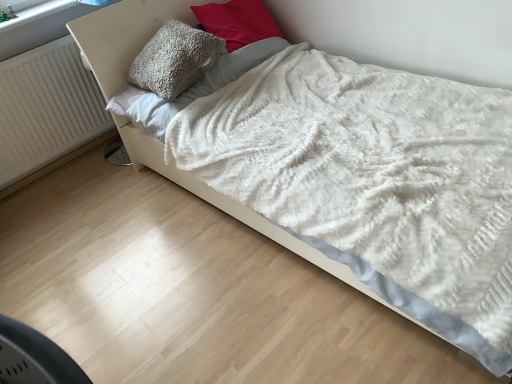
Locate an element on the screen. fluffy gray pillow at upper center, which is counted as the second pillow, starting from the right is located at coordinates (174, 59).

Image resolution: width=512 pixels, height=384 pixels. Describe the element at coordinates (174, 59) in the screenshot. I see `fluffy gray pillow at upper center, which is counted as the second pillow, starting from the right` at that location.

The height and width of the screenshot is (384, 512). I want to click on white ribbed radiator at left, so (x=46, y=108).

Find the location of a particular element. white fluffy sheet at upper center is located at coordinates tap(191, 88).

How much space does fuzzy gray pillow at upper center, which is the second pillow in left-to-right order, occupy vertically?

It is 15.24 inches.

You are a GUI agent. You are given a task and a screenshot of the screen. Output one action in this format:
    pyautogui.click(x=<x>, y=<y>)
    Task: Click on the fluffy gray pillow at upper center, positioned as the 1th pillow in left-to-right order
    This screenshot has width=512, height=384.
    Given the screenshot: What is the action you would take?
    pyautogui.click(x=174, y=59)

This screenshot has width=512, height=384. I want to click on sheet lying on the right of white ribbed radiator at left, so [x=191, y=88].

How many degrees apart are the facing directions of white ribbed radiator at left and white fluffy sheet at upper center?

The facing directions of white ribbed radiator at left and white fluffy sheet at upper center are 0.689 degrees apart.

From the picture: Which of these two, white ribbed radiator at left or white fluffy sheet at upper center, stands taller?

white ribbed radiator at left is taller.

Is point (236, 0) positioned in front of point (25, 139)?

Yes, it is in front of point (25, 139).

From the picture: Is fuzzy gray pillow at upper center, the 1th pillow positioned from the right, positioned behind white ribbed radiator at left?

Yes, fuzzy gray pillow at upper center, the 1th pillow positioned from the right, is behind white ribbed radiator at left.

Could you tell me if fuzzy gray pillow at upper center, the 1th pillow positioned from the right, is facing white ribbed radiator at left?

No, fuzzy gray pillow at upper center, the 1th pillow positioned from the right, is not aimed at white ribbed radiator at left.

From the image's perspective, which is below, fuzzy gray pillow at upper center, which is the second pillow in left-to-right order, or white ribbed radiator at left?

white ribbed radiator at left appears lower in the image.

Visually, is fluffy gray pillow at upper center, positioned as the 1th pillow in left-to-right order, positioned to the left or to the right of white plastic window frame at upper left?

From the image, it's evident that fluffy gray pillow at upper center, positioned as the 1th pillow in left-to-right order, is to the right of white plastic window frame at upper left.

Could you tell me if fluffy gray pillow at upper center, which is counted as the second pillow, starting from the right, is facing white plastic window frame at upper left?

No, fluffy gray pillow at upper center, which is counted as the second pillow, starting from the right, is not oriented towards white plastic window frame at upper left.

Considering the sizes of objects fluffy gray pillow at upper center, which is counted as the second pillow, starting from the right, and white plastic window frame at upper left in the image provided, who is shorter, fluffy gray pillow at upper center, which is counted as the second pillow, starting from the right, or white plastic window frame at upper left?

With less height is white plastic window frame at upper left.

Locate an element on the screen. Image resolution: width=512 pixels, height=384 pixels. window frame to the left of fluffy gray pillow at upper center, which is counted as the second pillow, starting from the right is located at coordinates (37, 13).

From a real-world perspective, is white ribbed radiator at left positioned under fluffy gray pillow at upper center, which is counted as the second pillow, starting from the right, based on gravity?

Yes, from a real-world perspective, white ribbed radiator at left is beneath fluffy gray pillow at upper center, which is counted as the second pillow, starting from the right.

Consider the image. What's the angular difference between white ribbed radiator at left and fluffy gray pillow at upper center, positioned as the 1th pillow in left-to-right order,'s facing directions?

The angle between the facing direction of white ribbed radiator at left and the facing direction of fluffy gray pillow at upper center, positioned as the 1th pillow in left-to-right order, is 0.689 degrees.

From the image's perspective, which object appears higher, white ribbed radiator at left or fluffy gray pillow at upper center, positioned as the 1th pillow in left-to-right order?

fluffy gray pillow at upper center, positioned as the 1th pillow in left-to-right order, appears higher in the image.

Consider the image. Considering the positions of objects white ribbed radiator at left and fluffy gray pillow at upper center, which is counted as the second pillow, starting from the right, in the image provided, who is more to the left, white ribbed radiator at left or fluffy gray pillow at upper center, which is counted as the second pillow, starting from the right,?

From the viewer's perspective, white ribbed radiator at left appears more on the left side.

Is the depth of fuzzy gray pillow at upper center, which is the second pillow in left-to-right order, greater than that of white fluffy sheet at upper center?

Yes, it is.

Are fuzzy gray pillow at upper center, the 1th pillow positioned from the right, and white fluffy sheet at upper center located far from each other?

No, fuzzy gray pillow at upper center, the 1th pillow positioned from the right, is not far away from white fluffy sheet at upper center.

What's the angular difference between fuzzy gray pillow at upper center, the 1th pillow positioned from the right, and white fluffy sheet at upper center's facing directions?

They differ by 4.89e-05 degrees in their facing directions.

Considering the sizes of objects fuzzy gray pillow at upper center, the 1th pillow positioned from the right, and white fluffy sheet at upper center in the image provided, who is bigger, fuzzy gray pillow at upper center, the 1th pillow positioned from the right, or white fluffy sheet at upper center?

With larger size is fuzzy gray pillow at upper center, the 1th pillow positioned from the right.

Considering the relative positions of white fluffy sheet at upper center and fluffy gray pillow at upper center, which is counted as the second pillow, starting from the right, in the image provided, is white fluffy sheet at upper center to the right of fluffy gray pillow at upper center, which is counted as the second pillow, starting from the right, from the viewer's perspective?

No.

From a real-world perspective, is white fluffy sheet at upper center physically located above or below fluffy gray pillow at upper center, positioned as the 1th pillow in left-to-right order?

In terms of real-world spatial position, white fluffy sheet at upper center is below fluffy gray pillow at upper center, positioned as the 1th pillow in left-to-right order.

Which of these two, white fluffy sheet at upper center or fluffy gray pillow at upper center, which is counted as the second pillow, starting from the right, is bigger?

Bigger between the two is fluffy gray pillow at upper center, which is counted as the second pillow, starting from the right.

Is white fluffy sheet at upper center wider or thinner than fluffy gray pillow at upper center, positioned as the 1th pillow in left-to-right order?

white fluffy sheet at upper center is thinner than fluffy gray pillow at upper center, positioned as the 1th pillow in left-to-right order.

At what (x,y) coordinates should I click in order to perform the action: click on window frame lying above the white ribbed radiator at left (from the image's perspective). Please return your answer as a coordinate pair (x, y). Looking at the image, I should click on (37, 13).

From the image's perspective, which is below, white ribbed radiator at left or white plastic window frame at upper left?

white ribbed radiator at left is shown below in the image.

In the scene shown: Is white ribbed radiator at left thinner than white plastic window frame at upper left?

Yes.

Is white ribbed radiator at left facing away from white plastic window frame at upper left?

No.

The width and height of the screenshot is (512, 384). In order to click on radiator located below the white fluffy sheet at upper center (from the image's perspective) in this screenshot , I will do (46, 108).

This screenshot has width=512, height=384. There is a white ribbed radiator at left. Identify the location of the 2nd pillow above it (from the image's perspective). (237, 22).

From the image, which object appears to be farther from fuzzy gray pillow at upper center, which is the second pillow in left-to-right order, white plastic window frame at upper left or white fluffy sheet at upper center?

Among the two, white plastic window frame at upper left is located further to fuzzy gray pillow at upper center, which is the second pillow in left-to-right order.

When comparing their distances from fluffy gray pillow at upper center, which is counted as the second pillow, starting from the right, does white plastic window frame at upper left or white ribbed radiator at left seem further?

white plastic window frame at upper left is positioned further to the anchor fluffy gray pillow at upper center, which is counted as the second pillow, starting from the right.

Considering their positions, is white ribbed radiator at left positioned closer to fuzzy gray pillow at upper center, which is the second pillow in left-to-right order, than white plastic window frame at upper left?

white plastic window frame at upper left is positioned closer to the anchor fuzzy gray pillow at upper center, which is the second pillow in left-to-right order.

Consider the image. Estimate the real-world distances between objects in this image. Which object is closer to white ribbed radiator at left, fuzzy gray pillow at upper center, which is the second pillow in left-to-right order, or white fluffy sheet at upper center?

Among the two, white fluffy sheet at upper center is located nearer to white ribbed radiator at left.

Looking at the image, which one is located further to fluffy gray pillow at upper center, positioned as the 1th pillow in left-to-right order, white plastic window frame at upper left or fuzzy gray pillow at upper center, the 1th pillow positioned from the right?

white plastic window frame at upper left.

Estimate the real-world distances between objects in this image. Which object is further from white ribbed radiator at left, white plastic window frame at upper left or white fluffy sheet at upper center?

white fluffy sheet at upper center lies further to white ribbed radiator at left than the other object.

Based on their spatial positions, is white plastic window frame at upper left or fluffy gray pillow at upper center, positioned as the 1th pillow in left-to-right order, further from white ribbed radiator at left?

fluffy gray pillow at upper center, positioned as the 1th pillow in left-to-right order, is further to white ribbed radiator at left.

Based on their spatial positions, is fuzzy gray pillow at upper center, the 1th pillow positioned from the right, or fluffy gray pillow at upper center, positioned as the 1th pillow in left-to-right order, further from white fluffy sheet at upper center?

fuzzy gray pillow at upper center, the 1th pillow positioned from the right.

Locate an element on the screen. Image resolution: width=512 pixels, height=384 pixels. sheet located between white ribbed radiator at left and fluffy gray pillow at upper center, which is counted as the second pillow, starting from the right, in the left-right direction is located at coordinates (191, 88).

Identify the location of sheet between white ribbed radiator at left and fuzzy gray pillow at upper center, the 1th pillow positioned from the right, from left to right. (191, 88).

Identify the location of pillow situated between white ribbed radiator at left and fuzzy gray pillow at upper center, the 1th pillow positioned from the right, from left to right. The height and width of the screenshot is (384, 512). (174, 59).

Find the location of a particular element. This screenshot has width=512, height=384. sheet between white plastic window frame at upper left and fuzzy gray pillow at upper center, the 1th pillow positioned from the right is located at coordinates coord(191,88).